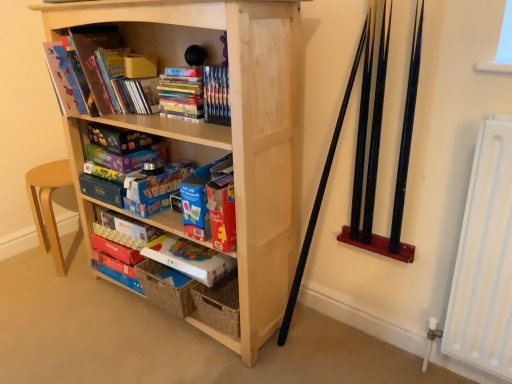
I want to click on free space above matte purple board game at center, which appears as the second paperback book when viewed from the top (from a real-world perspective), so click(x=126, y=144).